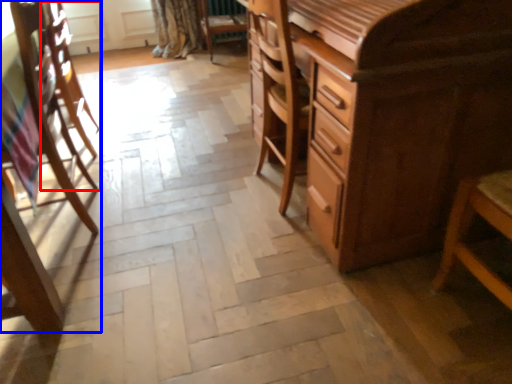
Question: Which of the following is the farthest to the observer, armchair (highlighted by a red box) or chair (highlighted by a blue box)?

Choices:
 (A) armchair
 (B) chair

Answer: (A)